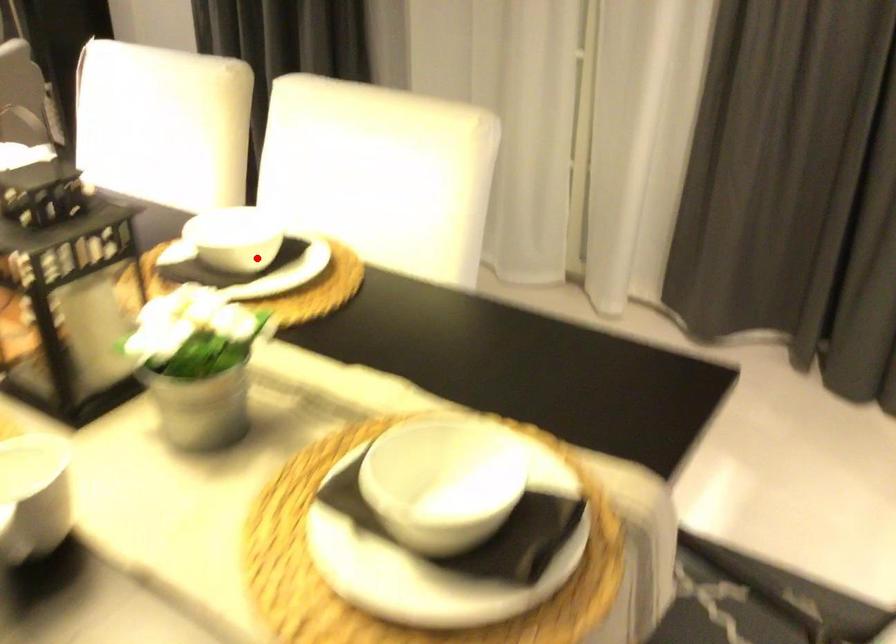
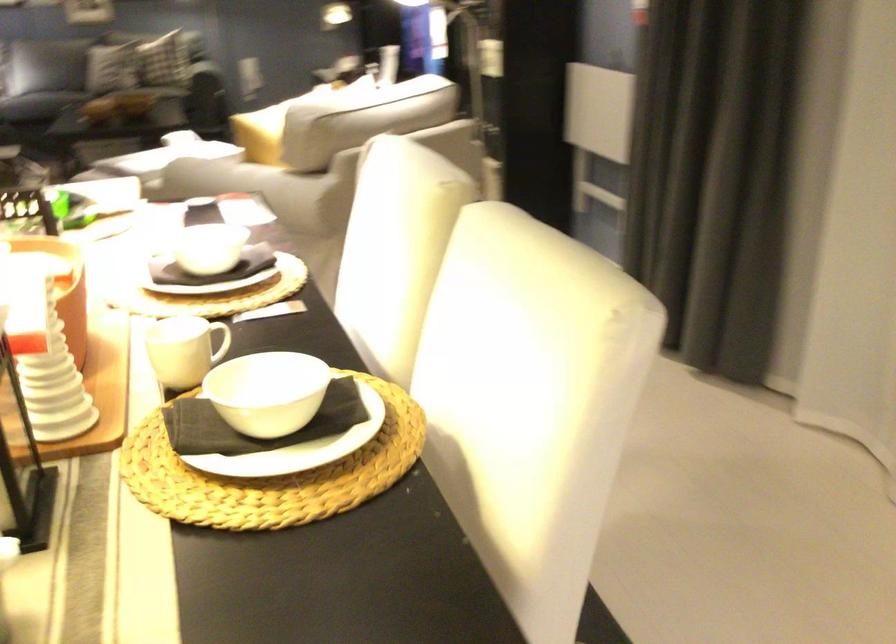
Question: I am providing you with two images of the same scene from different viewpoints. Image1 has a red point marked. In image2, the corresponding 3D location appears at what relative position? Reply with the corresponding letter.

Choices:
 (A) Closer
 (B) Farther

Answer: (A)